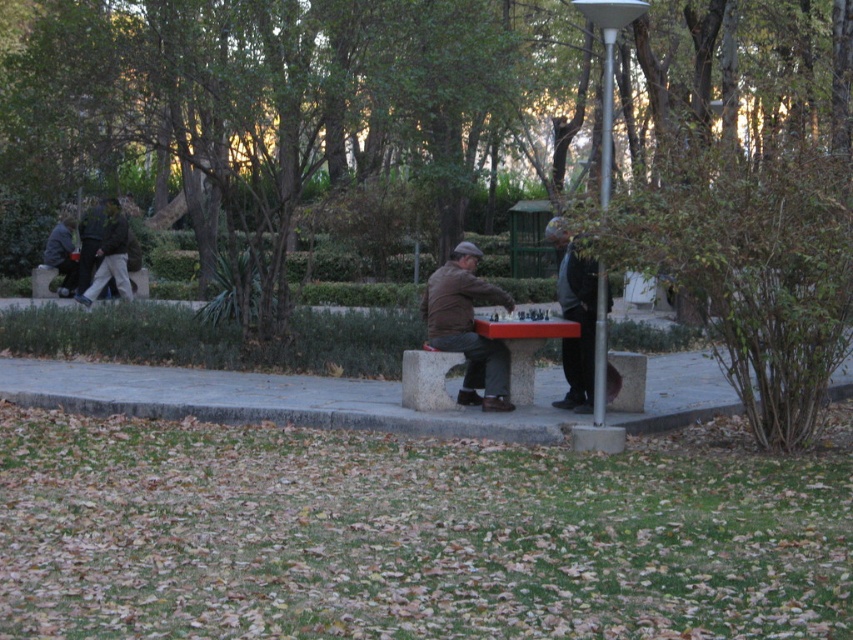
Does brown leather jacket at center come behind wooden bench at center?

No, it is in front of wooden bench at center.

In the scene shown: Between brown leather jacket at center and wooden bench at center, which one is positioned lower?

brown leather jacket at center is lower down.

Based on the photo, measure the distance between point (434,336) and camera.

They are 11.88 meters apart.

Where is `brown leather jacket at center`? Image resolution: width=853 pixels, height=640 pixels. brown leather jacket at center is located at coordinates (x=467, y=326).

Does point (526, 353) lie behind point (51, 296)?

No, (526, 353) is in front of (51, 296).

Is red plastic table at center positioned behind wooden bench at center?

That is False.

I want to click on red plastic table at center, so click(523, 340).

Between brown leather jacket at center and dark brown leather jacket at center, which one is positioned higher?

brown leather jacket at center is above.

Which is below, brown leather jacket at center or dark brown leather jacket at center?

Positioned lower is dark brown leather jacket at center.

The image size is (853, 640). Identify the location of brown leather jacket at center. (467, 326).

Locate an element on the screen. This screenshot has width=853, height=640. brown leather jacket at center is located at coordinates (x=467, y=326).